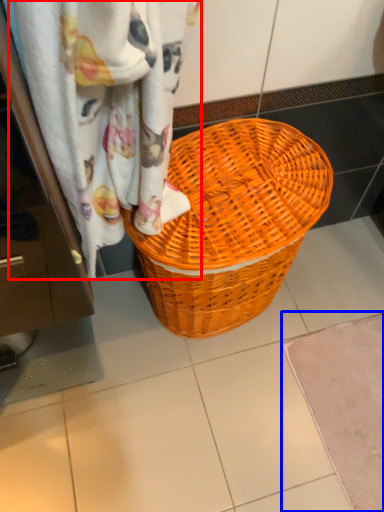
Question: Which object appears closest to the camera in this image, curtain (highlighted by a red box) or bath mat (highlighted by a blue box)?

Choices:
 (A) curtain
 (B) bath mat

Answer: (A)